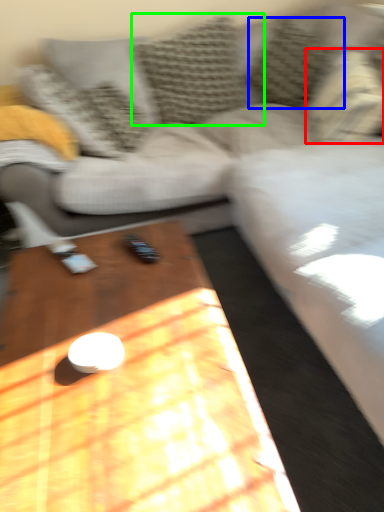
Question: Estimate the real-world distances between objects in this image. Which object is closer to pillow (highlighted by a red box), pillow (highlighted by a blue box) or pillow (highlighted by a green box)?

Choices:
 (A) pillow
 (B) pillow

Answer: (A)